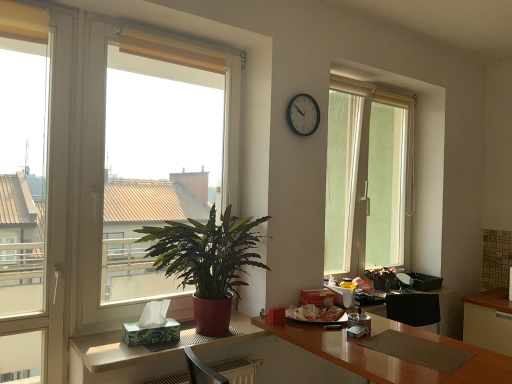
Question: Is green glossy plant at left, which is the 1th houseplant from front to back, bigger than beige fabric curtain at upper center?

Choices:
 (A) no
 (B) yes

Answer: (B)

Question: Does green glossy plant at left, which is the 1th houseplant from front to back, lie behind beige fabric curtain at upper center?

Choices:
 (A) no
 (B) yes

Answer: (A)

Question: Is green glossy plant at left, which is the 1th houseplant from front to back, positioned with its back to beige fabric curtain at upper center?

Choices:
 (A) yes
 (B) no

Answer: (B)

Question: Could you tell me if green glossy plant at left, which is the 1th houseplant in left-to-right order, is facing beige fabric curtain at upper center?

Choices:
 (A) yes
 (B) no

Answer: (B)

Question: Does green glossy plant at left, positioned as the second houseplant in back-to-front order, have a greater height compared to beige fabric curtain at upper center?

Choices:
 (A) no
 (B) yes

Answer: (B)

Question: From the image's perspective, is green glossy plant at left, the second houseplant from the right, below beige fabric curtain at upper center?

Choices:
 (A) no
 (B) yes

Answer: (B)

Question: Is white glossy table at lower left not close to brown glossy desk at center?

Choices:
 (A) no
 (B) yes

Answer: (A)

Question: From a real-world perspective, is white glossy table at lower left on brown glossy desk at center?

Choices:
 (A) yes
 (B) no

Answer: (A)

Question: Does white glossy table at lower left have a larger size compared to brown glossy desk at center?

Choices:
 (A) no
 (B) yes

Answer: (A)

Question: Is white glossy table at lower left oriented towards brown glossy desk at center?

Choices:
 (A) yes
 (B) no

Answer: (B)

Question: Is white glossy table at lower left at the left side of brown glossy desk at center?

Choices:
 (A) no
 (B) yes

Answer: (B)

Question: Can you confirm if white glossy table at lower left is taller than brown glossy desk at center?

Choices:
 (A) yes
 (B) no

Answer: (B)

Question: Is white glossy cabinet at lower right behind white glossy table at lower left?

Choices:
 (A) no
 (B) yes

Answer: (B)